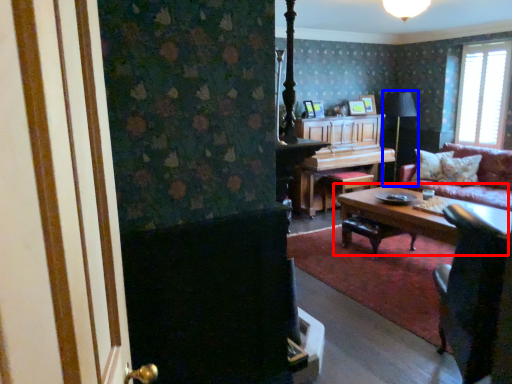
Question: Which of the following is the farthest to the observer, coffee table (highlighted by a red box) or table lamp (highlighted by a blue box)?

Choices:
 (A) coffee table
 (B) table lamp

Answer: (B)